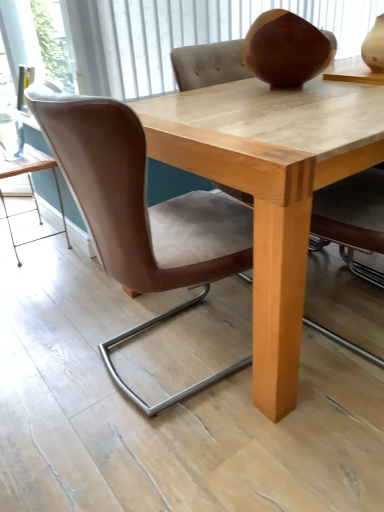
Question: Is transparent glass door at upper left inside the boundaries of light brown wood table at lower left, or outside?

Choices:
 (A) inside
 (B) outside

Answer: (B)

Question: Is transparent glass door at upper left to the left or to the right of light brown wood table at lower left in the image?

Choices:
 (A) left
 (B) right

Answer: (B)

Question: Which object is positioned closest to the brown leather chair at center?

Choices:
 (A) light brown wood table at lower left
 (B) transparent glass door at upper left

Answer: (A)

Question: Which is farther from the brown leather chair at center?

Choices:
 (A) light brown wood table at lower left
 (B) transparent glass door at upper left

Answer: (B)